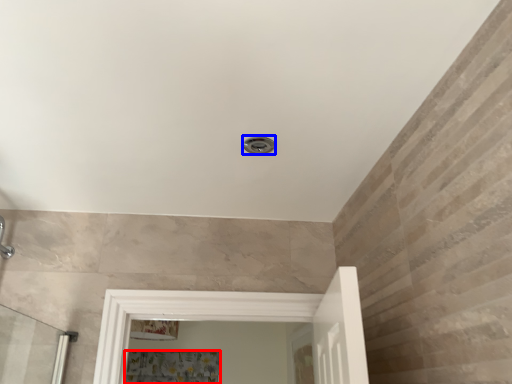
Question: Which object appears closest to the camera in this image, shower curtain (highlighted by a red box) or shower (highlighted by a blue box)?

Choices:
 (A) shower curtain
 (B) shower

Answer: (B)